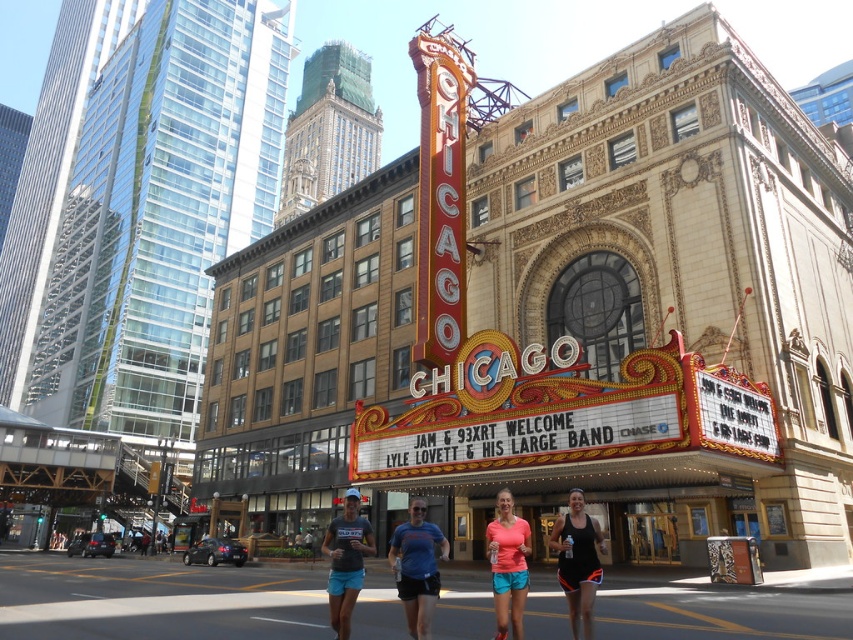
You are a photographer standing in the middle of the street facing the gold ornate theater at center and the blue fabric shirt at center. Which object is located to your left?

The blue fabric shirt at center is located to your left since the gold ornate theater at center is positioned on the right side of it.

You are a photographer at the Chicago Theatre event. You need to capture a photo of the blue fabric shirt at center and the matte coral tank top at center. Which of the two clothing items has a wider width?

The blue fabric shirt at center has a wider width than the matte coral tank top at center.